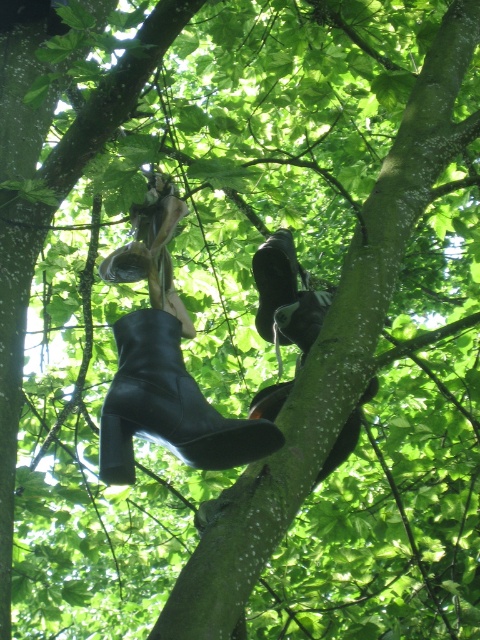
Is black leather boot at center shorter than black leather boot at upper center?

In fact, black leather boot at center may be taller than black leather boot at upper center.

Which of these two, black leather boot at center or black leather boot at upper center, stands taller?

With more height is black leather boot at center.

Locate an element on the screen. Image resolution: width=480 pixels, height=640 pixels. black leather boot at center is located at coordinates (168, 404).